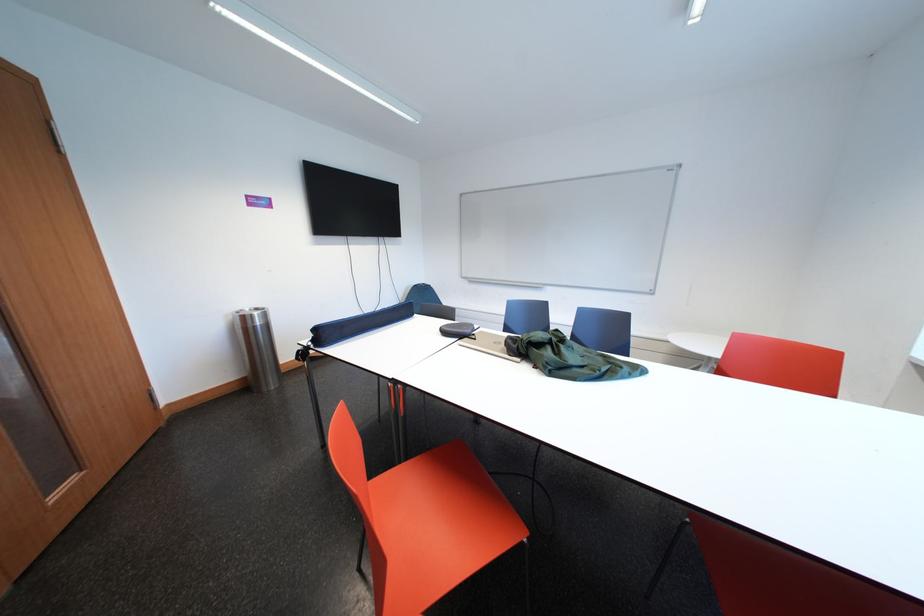
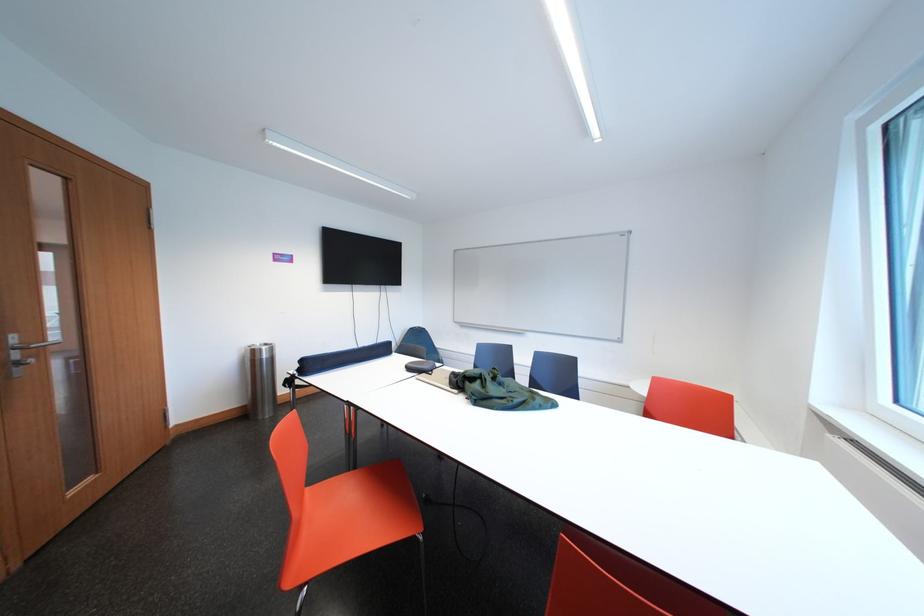
The point at (362, 211) is marked in the first image. Where is the corresponding point in the second image?

(371, 265)